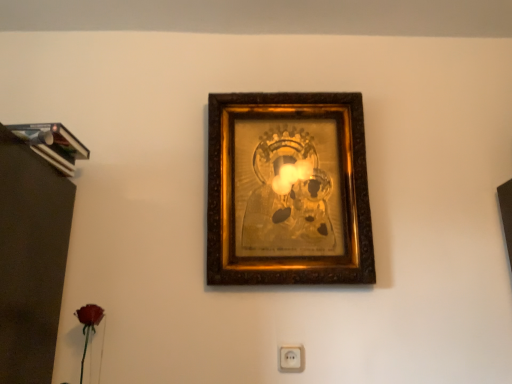
Question: Considering the positions of point (269, 125) and point (296, 362), is point (269, 125) closer or farther from the camera than point (296, 362)?

Choices:
 (A) closer
 (B) farther

Answer: (B)

Question: Based on their positions, is gold ornate frame at center located to the left or right of white plastic/socket at lower center?

Choices:
 (A) right
 (B) left

Answer: (A)

Question: Is gold ornate frame at center spatially inside white plastic/socket at lower center, or outside of it?

Choices:
 (A) outside
 (B) inside

Answer: (A)

Question: Considering the positions of white plastic/socket at lower center and gold ornate frame at center in the image, is white plastic/socket at lower center wider or thinner than gold ornate frame at center?

Choices:
 (A) wide
 (B) thin

Answer: (B)

Question: From a real-world perspective, is white plastic/socket at lower center positioned above or below gold ornate frame at center?

Choices:
 (A) above
 (B) below

Answer: (B)

Question: Considering the positions of point (288, 370) and point (347, 230), is point (288, 370) closer or farther from the camera than point (347, 230)?

Choices:
 (A) closer
 (B) farther

Answer: (A)

Question: Do you think white plastic/socket at lower center is within gold ornate frame at center, or outside of it?

Choices:
 (A) outside
 (B) inside

Answer: (A)